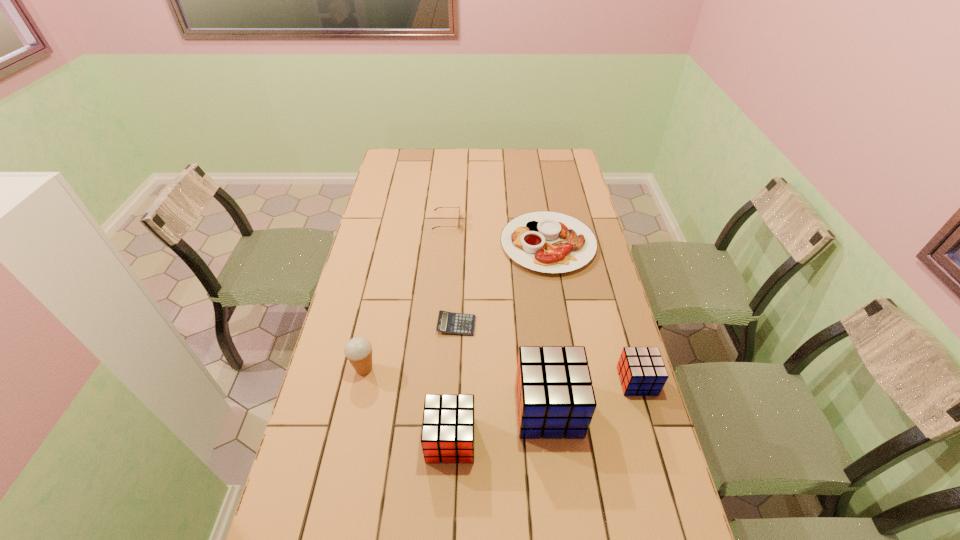
In order to click on free region that satisfies the following two spatial constraints: 1. on the lenses of the tallest cube; 2. on the right side of the sunglasses in this screenshot , I will do `click(431, 409)`.

Where is `vacant region that satisfies the following two spatial constraints: 1. on the front side of the second tallest cube; 2. on the right side of the leftmost object`? The height and width of the screenshot is (540, 960). vacant region that satisfies the following two spatial constraints: 1. on the front side of the second tallest cube; 2. on the right side of the leftmost object is located at coordinates (348, 440).

This screenshot has height=540, width=960. What are the coordinates of `blank area in the image that satisfies the following two spatial constraints: 1. on the lenses of the shortest object; 2. on the right side of the sunglasses` in the screenshot? It's located at (438, 325).

Identify the location of vacant point that satisfies the following two spatial constraints: 1. on the back side of the fourth tallest object; 2. on the lenses of the sunglasses. This screenshot has height=540, width=960. (591, 222).